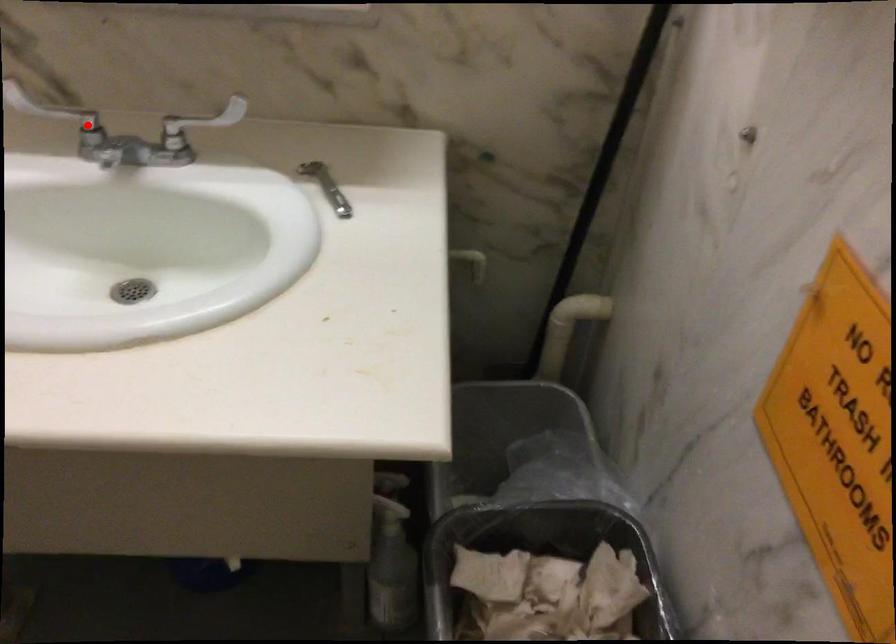
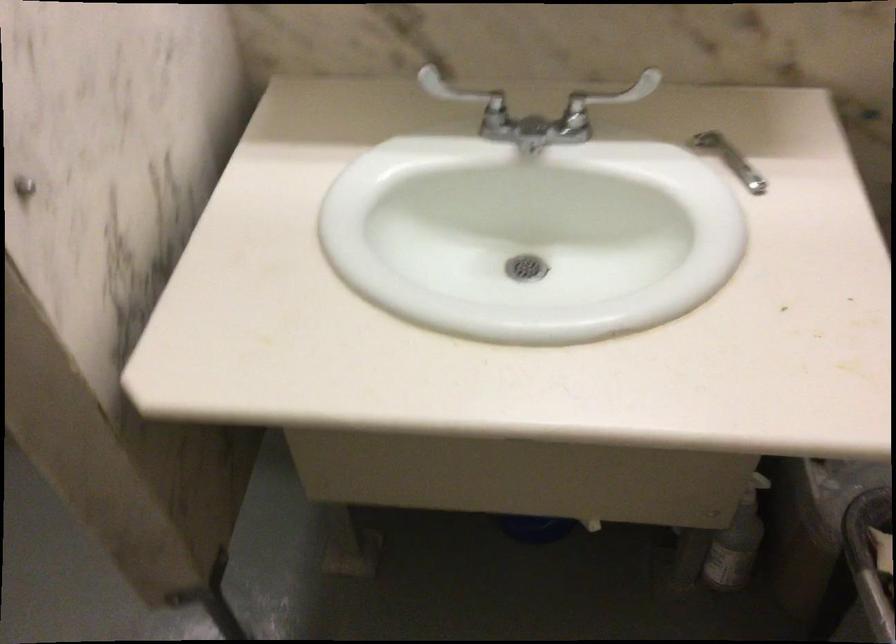
Question: I am providing you with two images of the same scene from different viewpoints. Image1 has a red point marked. In image2, the corresponding 3D location appears at what relative position? Reply with the corresponding letter.

Choices:
 (A) Closer
 (B) Farther

Answer: (B)